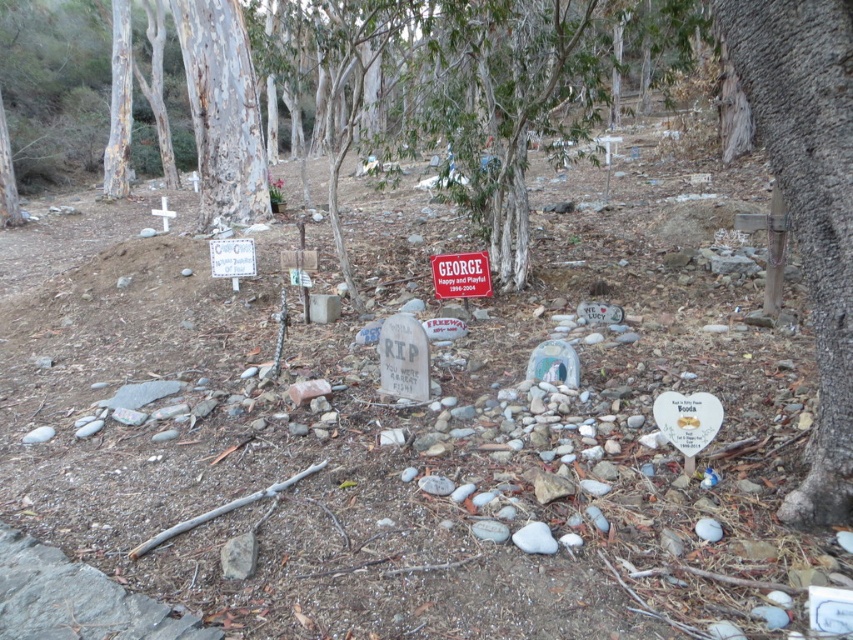
Is white smooth tree trunk at upper center thinner than smooth bark tree at upper left?

No, white smooth tree trunk at upper center is not thinner than smooth bark tree at upper left.

Between white smooth tree trunk at upper center and smooth bark tree at upper left, which one has more height?

white smooth tree trunk at upper center is taller.

Is point (215, 83) positioned behind point (117, 99)?

No, (215, 83) is in front of (117, 99).

Find the location of `white smooth tree trunk at upper center`. white smooth tree trunk at upper center is located at coordinates (222, 112).

Who is positioned more to the left, brown rough bark tree at right or white smooth tree trunk at upper center?

Positioned to the left is white smooth tree trunk at upper center.

Is point (782, 51) more distant than point (195, 92)?

No.

Is point (817, 86) farther from viewer compared to point (178, 40)?

No, (817, 86) is closer to viewer.

The image size is (853, 640). What are the coordinates of `brown rough bark tree at right` in the screenshot? It's located at (809, 204).

Is point (231, 147) positioned behind point (425, 339)?

That is True.

Does point (189, 13) come in front of point (412, 362)?

No, it is behind (412, 362).

You are a GUI agent. You are given a task and a screenshot of the screen. Output one action in this format:
    pyautogui.click(x=<x>, y=<y>)
    Task: Click on the white smooth tree trunk at upper center
    
    Given the screenshot: What is the action you would take?
    pyautogui.click(x=222, y=112)